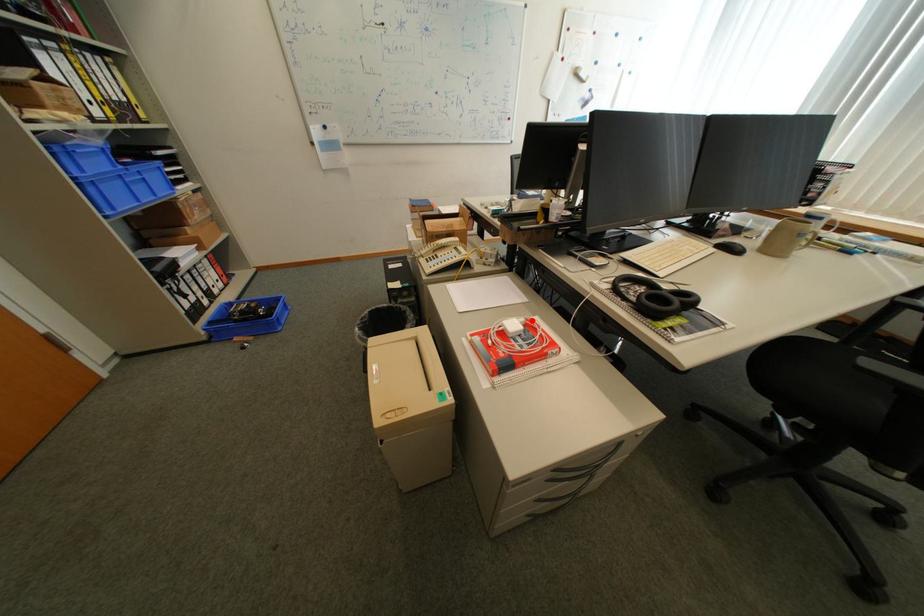
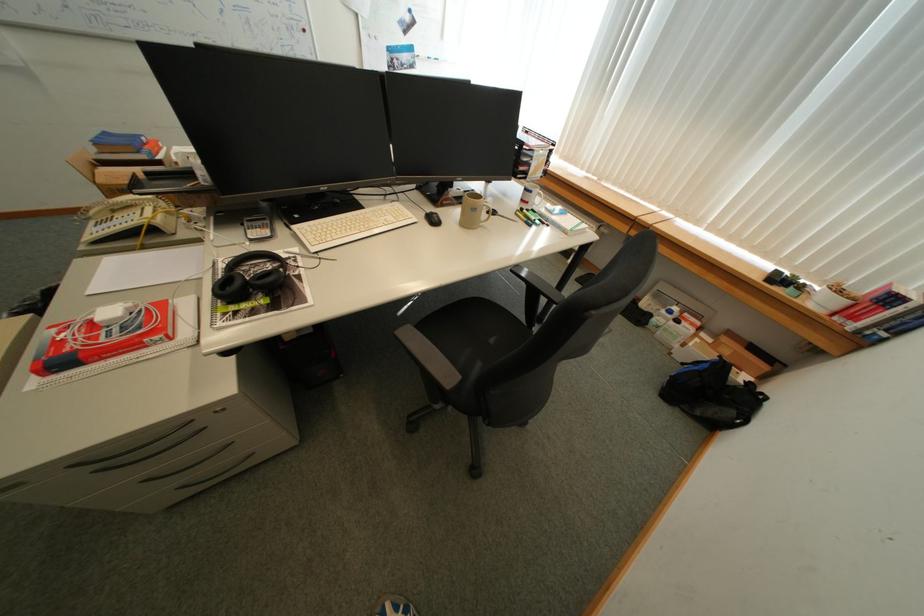
The point at the highlighted location is marked in the first image. Where is the corresponding point in the second image?

(140, 305)